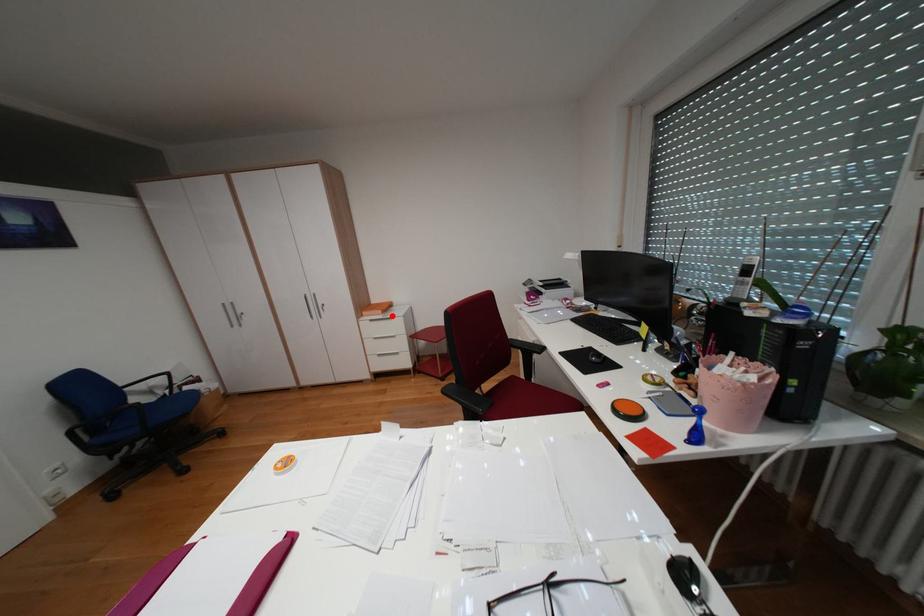
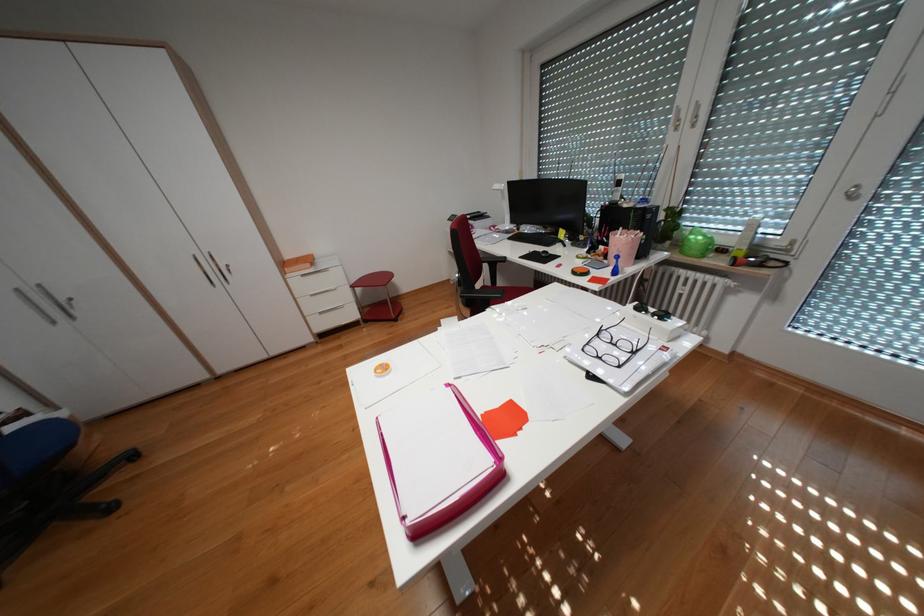
In the second image, find the point that corresponds to the highlighted location in the first image.

(324, 270)